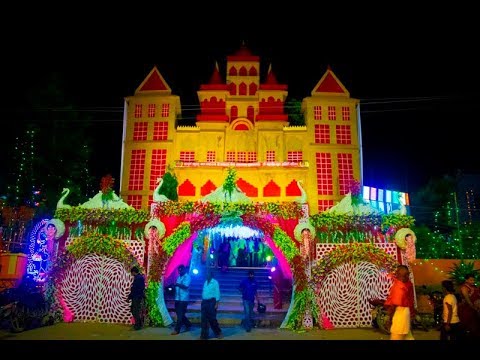
You are a GUI agent. You are given a task and a screenshot of the screen. Output one action in this format:
    pyautogui.click(x=<x>, y=<y>)
    Task: Click on the stairs
    
    Given the screenshot: What is the action you would take?
    pyautogui.click(x=230, y=290)